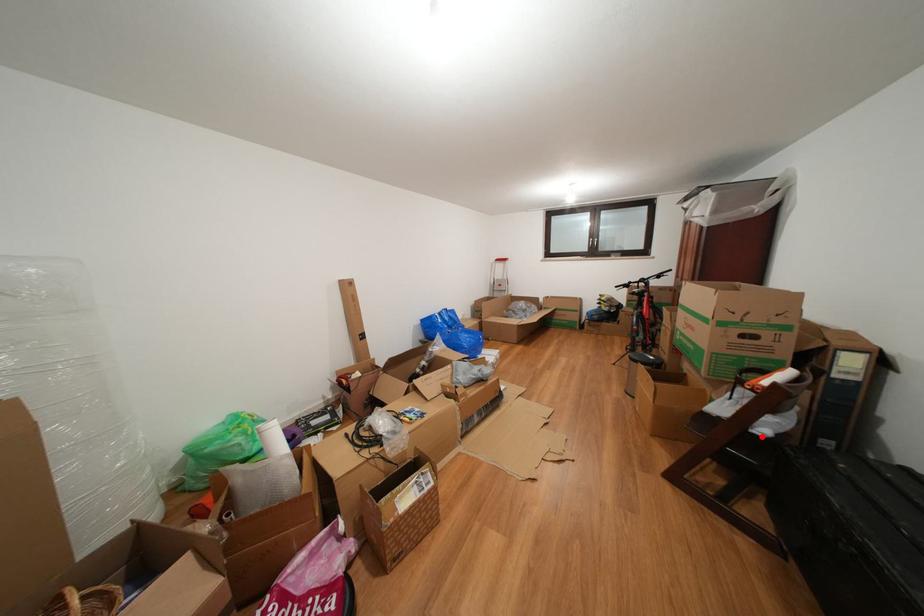
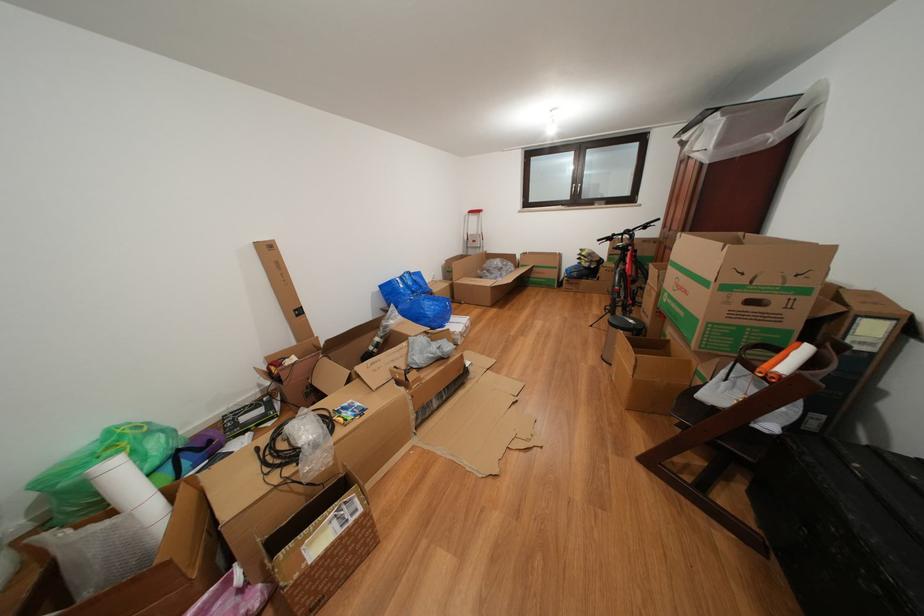
Find the pixel in the second image that matches the highlighted location in the first image.

(763, 431)